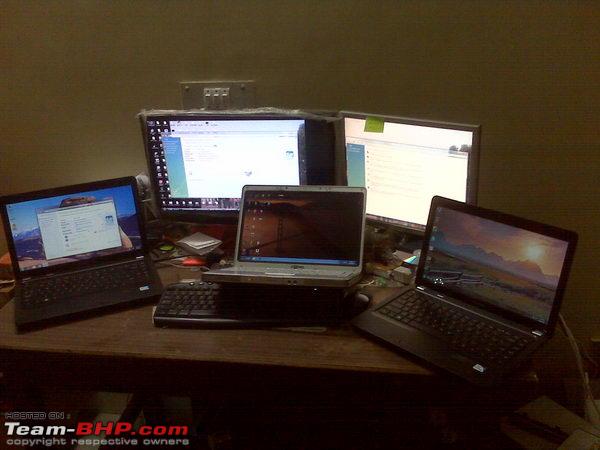
Where is `monitor on right`? monitor on right is located at coordinates (423, 153).